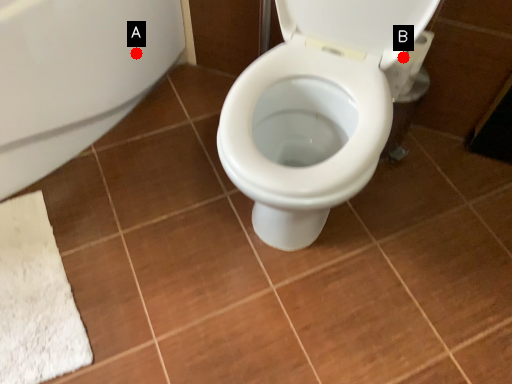
Question: Two points are circled on the image, labeled by A and B beside each circle. Which point appears closest to the camera in this image?

Choices:
 (A) A is closer
 (B) B is closer

Answer: (B)